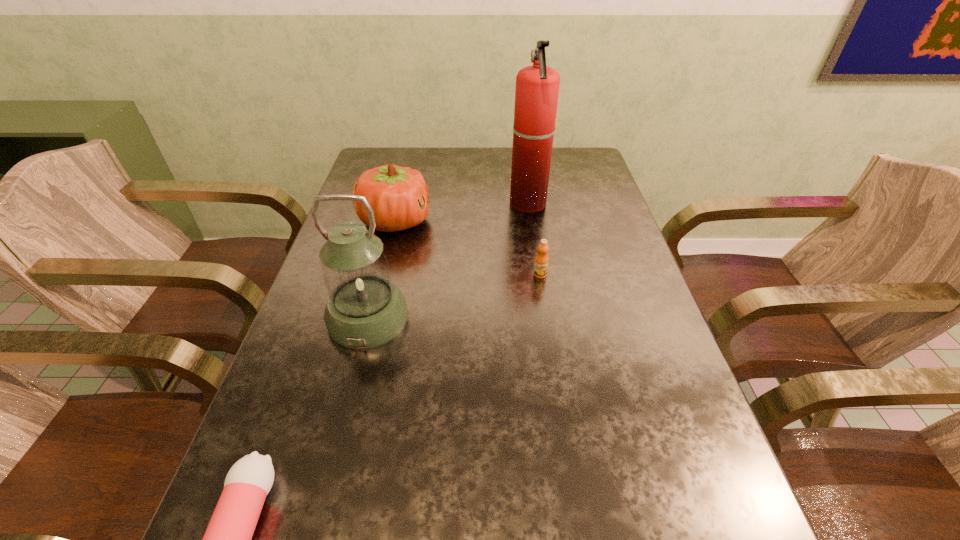
Locate an element on the screen. vacant space located on the side of the pumpkin with the cute face is located at coordinates (534, 221).

Locate an element on the screen. vacant area situated 0.200m on the front label of the orange juice is located at coordinates (551, 343).

Where is `lantern positioned at the left edge`? Image resolution: width=960 pixels, height=540 pixels. lantern positioned at the left edge is located at coordinates (364, 309).

The width and height of the screenshot is (960, 540). What are the coordinates of `pumpkin that is at the left edge` in the screenshot? It's located at (399, 197).

At what (x,y) coordinates should I click in order to perform the action: click on vacant space at the far edge. Please return your answer as a coordinate pair (x, y). The width and height of the screenshot is (960, 540). Looking at the image, I should click on (427, 162).

Identify the location of vacant area at the left edge of the desktop. (340, 411).

This screenshot has height=540, width=960. I want to click on free space at the right edge of the desktop, so pyautogui.click(x=631, y=322).

Locate an element on the screen. free region at the far right corner of the desktop is located at coordinates (597, 181).

Where is `unoccupied position between the fourth farthest object and the third nearest object`? unoccupied position between the fourth farthest object and the third nearest object is located at coordinates (454, 296).

Locate an element on the screen. This screenshot has height=540, width=960. vacant area that lies between the fourth shortest object and the tallest object is located at coordinates (448, 261).